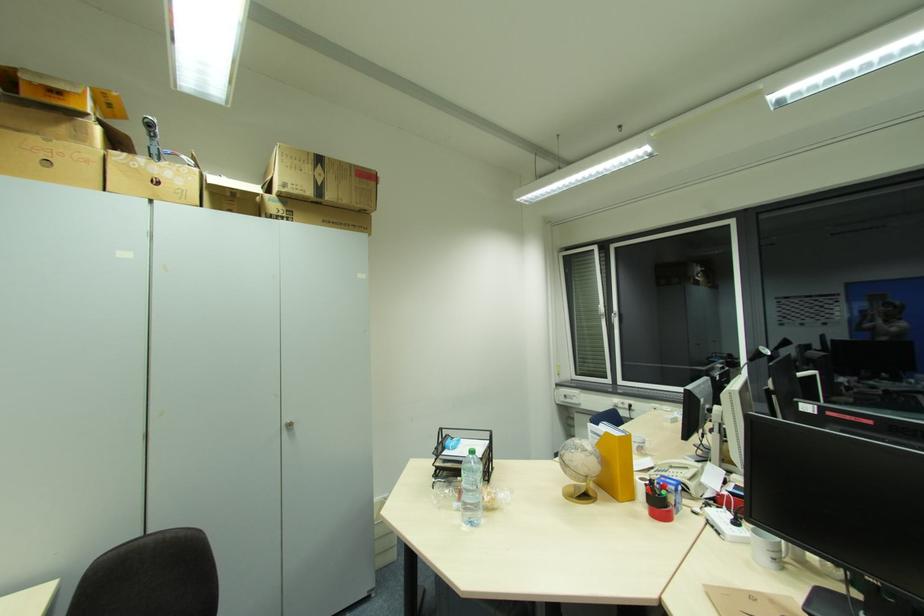
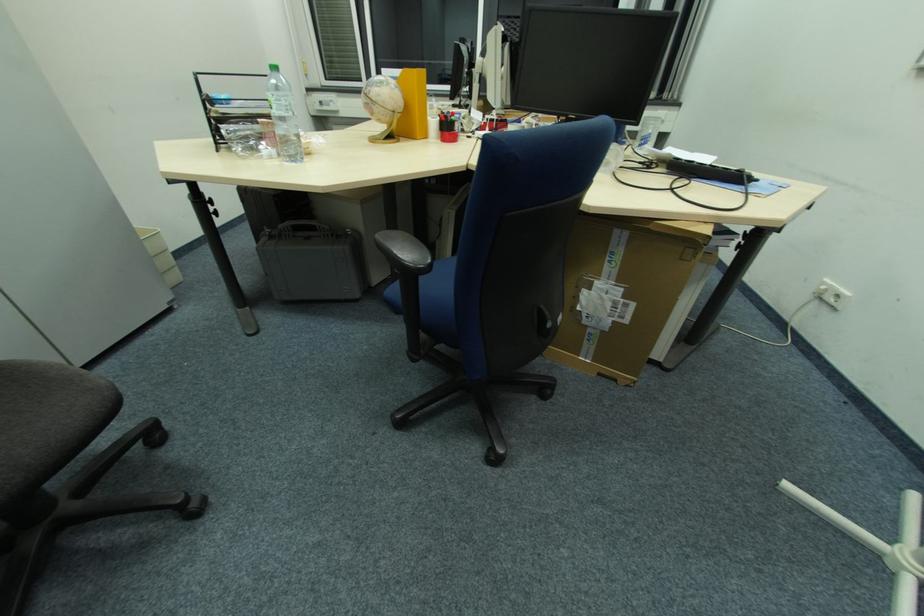
Based on the continuous images, in which direction is the camera rotating?

The camera's rotation is toward right-down.